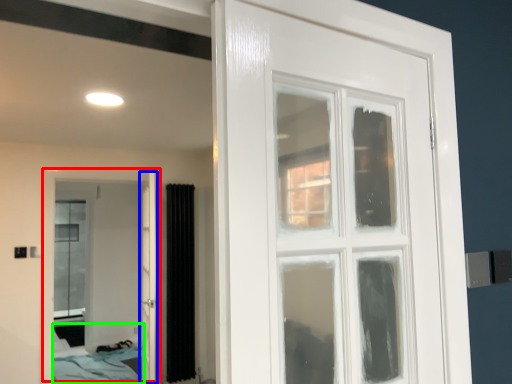
Question: Considering the real-world distances, which object is closest to door (highlighted by a red box)? door (highlighted by a blue box) or bed (highlighted by a green box).

Choices:
 (A) door
 (B) bed

Answer: (B)